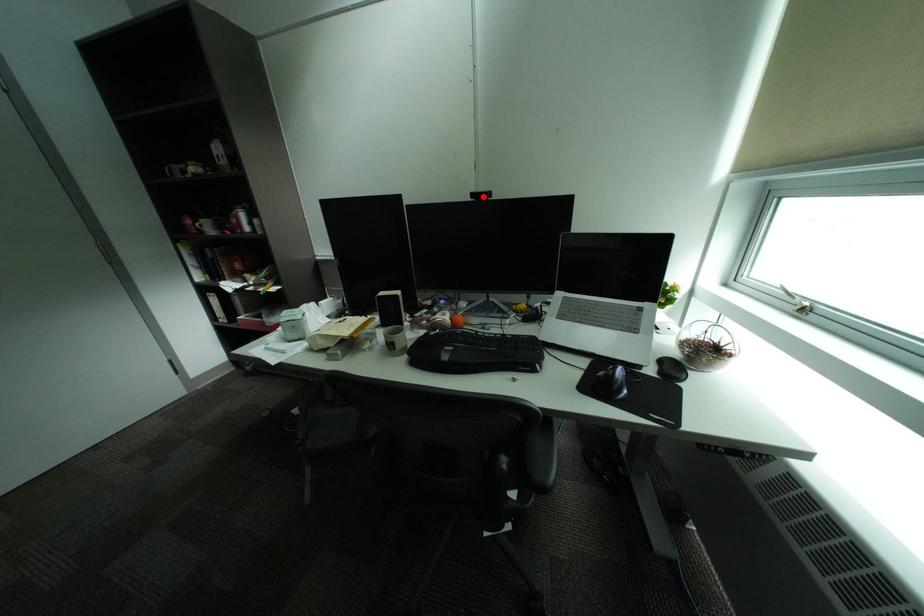
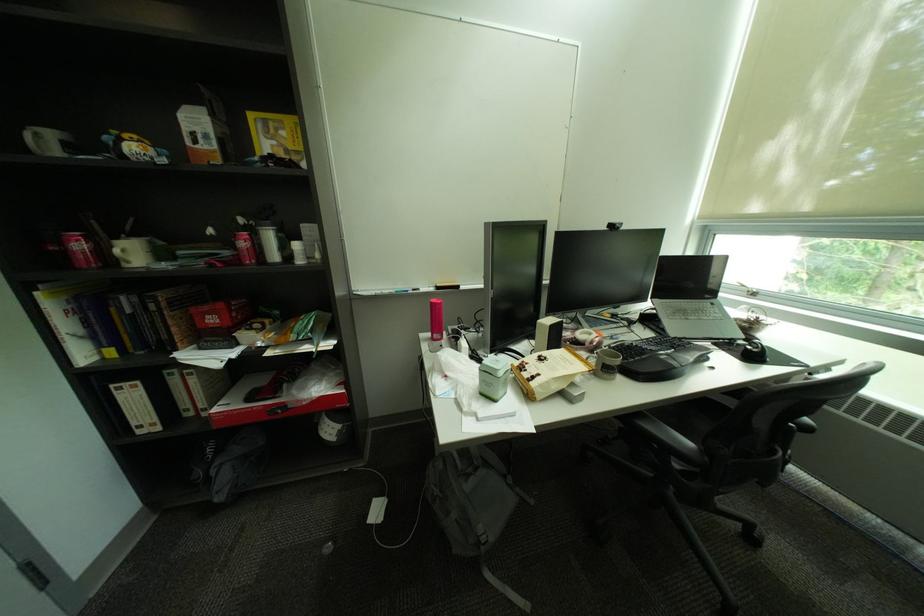
In the second image, find the point that corresponds to the highlighted location in the first image.

(621, 227)